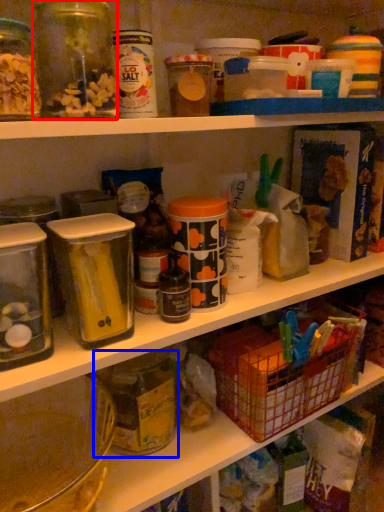
Question: Which object appears farthest to the camera in this image, glass jar (highlighted by a red box) or glass jar (highlighted by a blue box)?

Choices:
 (A) glass jar
 (B) glass jar

Answer: (B)